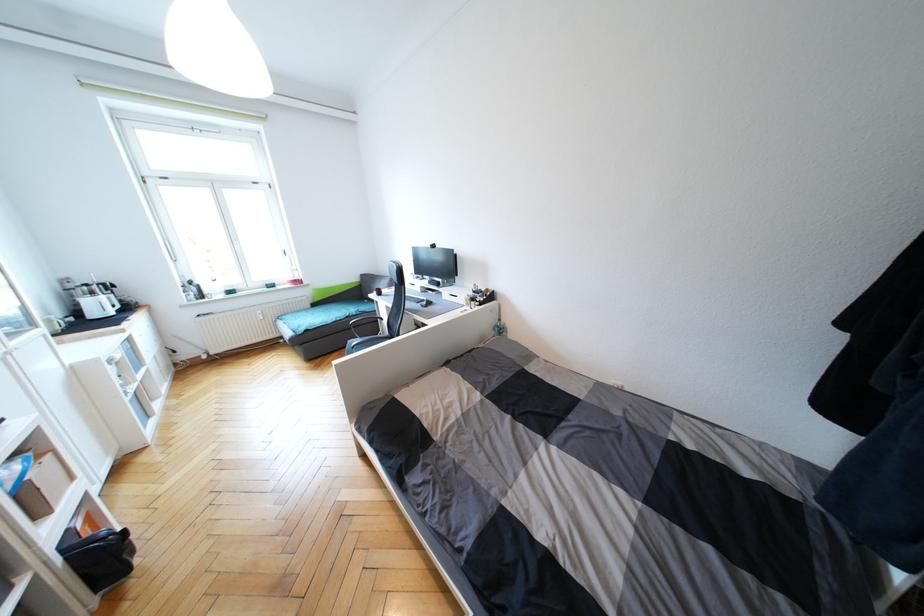
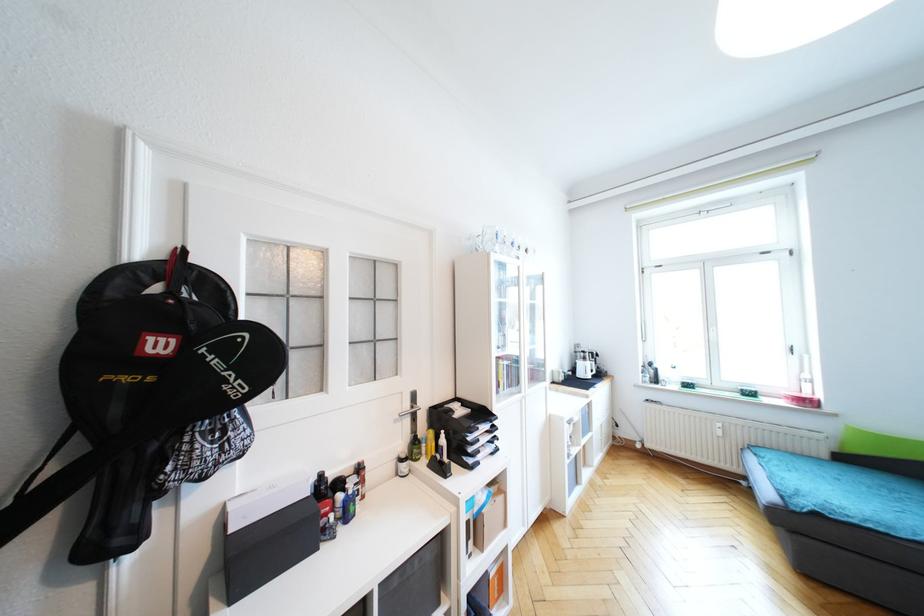
Question: The camera is either moving clockwise (left) or counter-clockwise (right) around the object. The first image is from the beginning of the video and the second image is from the end. Is the camera moving left or right when shooting the video?

Choices:
 (A) Left
 (B) Right

Answer: (B)